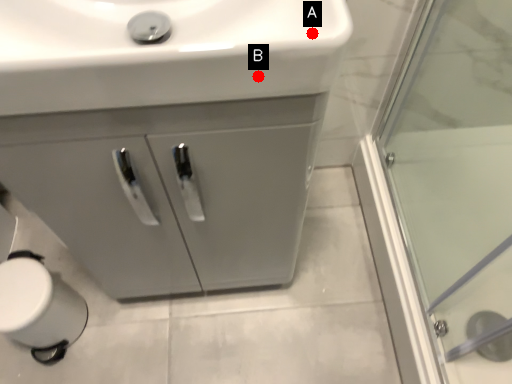
Question: Two points are circled on the image, labeled by A and B beside each circle. Which point is farther from the camera taking this photo?

Choices:
 (A) A is further
 (B) B is further

Answer: (A)